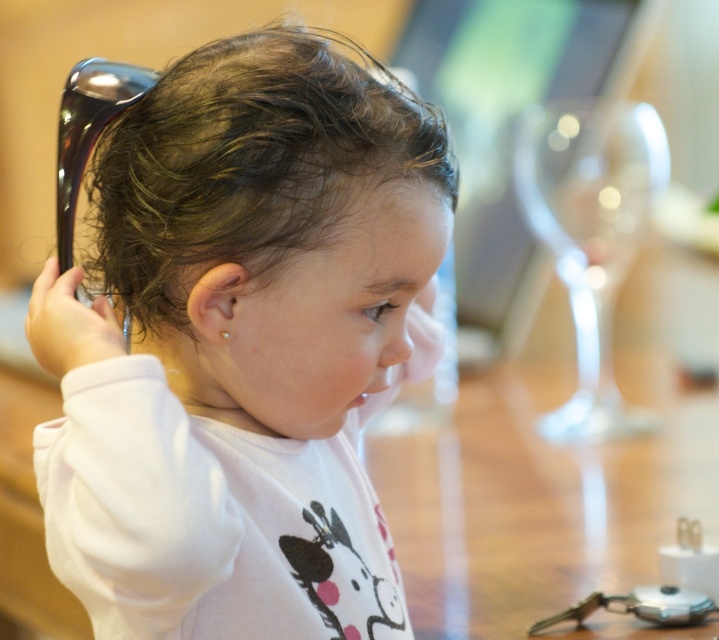
Is white matte toddler at center shorter than dark brown curly hair at center?

No.

Where is `white matte toddler at center`? The height and width of the screenshot is (640, 719). white matte toddler at center is located at coordinates (242, 346).

Does point (151, 570) come in front of point (319, 184)?

That is True.

You are a GUI agent. You are given a task and a screenshot of the screen. Output one action in this format:
    pyautogui.click(x=<x>, y=<y>)
    Task: Click on the white matte toddler at center
    The width and height of the screenshot is (719, 640).
    Given the screenshot: What is the action you would take?
    pyautogui.click(x=242, y=346)